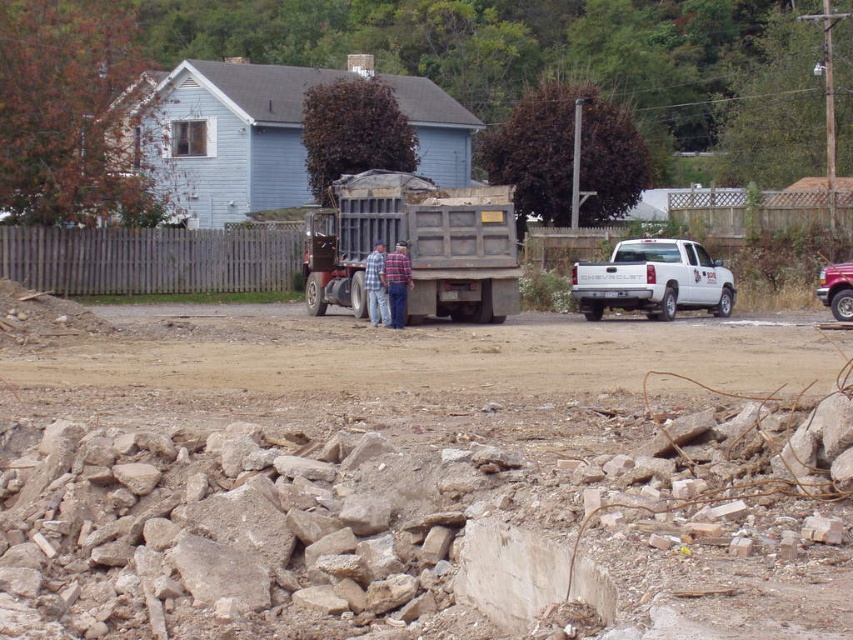
Question: Which object is positioned farthest from the blue plaid shirt at center?

Choices:
 (A) gray gravel dirt field at lower center
 (B) brown dirt field at center
 (C) white matte truck at right
 (D) gray metallic dump truck at center

Answer: (A)

Question: Observing the image, what is the correct spatial positioning of gray gravel dirt field at lower center in reference to plaid shirt at center?

Choices:
 (A) above
 (B) below

Answer: (B)

Question: Does brown dirt field at center have a smaller size compared to blue plaid shirt at center?

Choices:
 (A) no
 (B) yes

Answer: (A)

Question: Which object appears farthest from the camera in this image?

Choices:
 (A) gray gravel dirt field at lower center
 (B) gray metallic dump truck at center

Answer: (B)

Question: Based on their relative distances, which object is nearer to the blue plaid shirt at center?

Choices:
 (A) gray gravel dirt field at lower center
 (B) white matte truck at right
 (C) gray metallic dump truck at center

Answer: (C)

Question: Is brown dirt field at center above white matte truck at right?

Choices:
 (A) no
 (B) yes

Answer: (A)